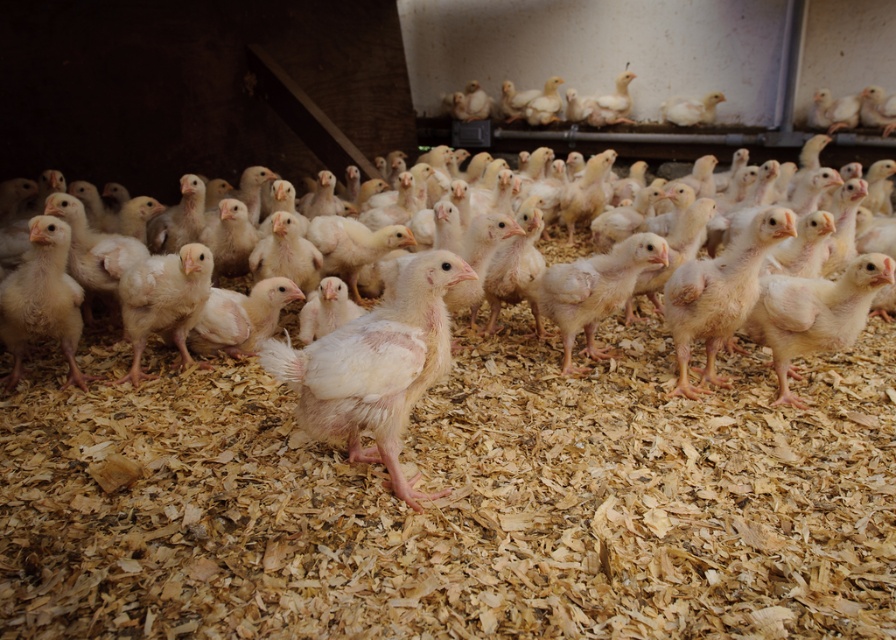
Question: Where is white fluffy chicken at center located in relation to white fluffy chick at center in the image?

Choices:
 (A) left
 (B) right

Answer: (B)

Question: Which of the following is the closest to the observer?

Choices:
 (A) white fluffy chick at center
 (B) white fluffy chicken at center

Answer: (B)

Question: Which point appears closest to the camera in this image?

Choices:
 (A) (501, 349)
 (B) (406, 336)

Answer: (B)

Question: Is white fluffy chicken at center smaller than white fluffy chick at center?

Choices:
 (A) yes
 (B) no

Answer: (B)

Question: Does white fluffy chicken at center have a larger size compared to white fluffy chick at center?

Choices:
 (A) no
 (B) yes

Answer: (B)